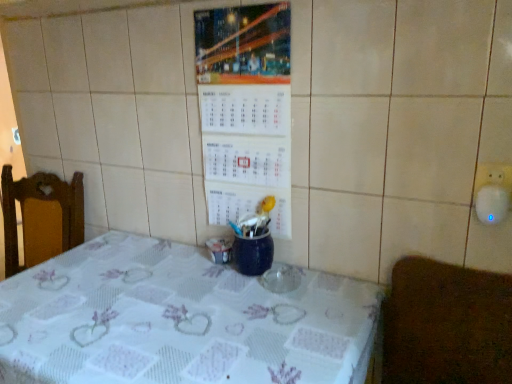
Question: Is white paper calendar at center inside the boundaries of brown textured mat at lower right, or outside?

Choices:
 (A) inside
 (B) outside

Answer: (B)

Question: In terms of size, does white paper calendar at center appear bigger or smaller than brown textured mat at lower right?

Choices:
 (A) small
 (B) big

Answer: (A)

Question: Considering the real-world distances, which object is closest to the white printed tablecloth at center?

Choices:
 (A) brown textured mat at lower right
 (B) white paper calendar at center

Answer: (A)

Question: Which object is the farthest from the brown textured mat at lower right?

Choices:
 (A) white paper calendar at center
 (B) white printed tablecloth at center

Answer: (A)